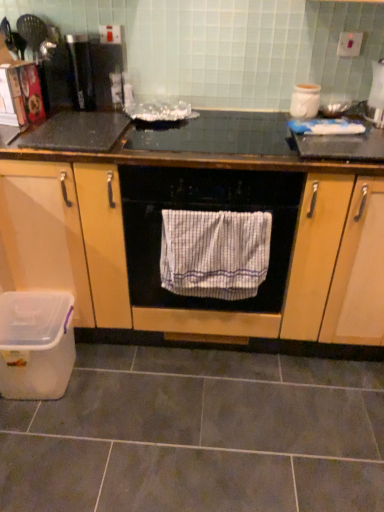
Question: Is white striped towel at center in front of white glossy kettle at upper right, which appears as the first appliance when viewed from the right?

Choices:
 (A) yes
 (B) no

Answer: (A)

Question: Is white striped towel at center looking in the opposite direction of white glossy kettle at upper right, which appears as the 2th appliance when viewed from the left?

Choices:
 (A) yes
 (B) no

Answer: (B)

Question: From the image's perspective, is white striped towel at center below white glossy kettle at upper right, which appears as the 2th appliance when viewed from the left?

Choices:
 (A) no
 (B) yes

Answer: (B)

Question: Does white striped towel at center have a lesser width compared to white glossy kettle at upper right, which appears as the first appliance when viewed from the right?

Choices:
 (A) yes
 (B) no

Answer: (A)

Question: Is white striped towel at center at the left side of white glossy kettle at upper right, which appears as the 2th appliance when viewed from the left?

Choices:
 (A) no
 (B) yes

Answer: (B)

Question: Is white striped towel at center positioned behind white glossy kettle at upper right, which appears as the 2th appliance when viewed from the left?

Choices:
 (A) yes
 (B) no

Answer: (B)

Question: Is gray matte tile at lower center wider than wooden cabinet at center?

Choices:
 (A) no
 (B) yes

Answer: (B)

Question: From the image's perspective, is gray matte tile at lower center located beneath wooden cabinet at center?

Choices:
 (A) yes
 (B) no

Answer: (A)

Question: Does gray matte tile at lower center come in front of wooden cabinet at center?

Choices:
 (A) yes
 (B) no

Answer: (A)

Question: Does gray matte tile at lower center appear on the left side of wooden cabinet at center?

Choices:
 (A) no
 (B) yes

Answer: (B)

Question: From a real-world perspective, does gray matte tile at lower center sit lower than wooden cabinet at center?

Choices:
 (A) yes
 (B) no

Answer: (A)

Question: Is gray matte tile at lower center taller than wooden cabinet at center?

Choices:
 (A) no
 (B) yes

Answer: (A)

Question: Is gray matte tile at lower center positioned behind white striped towel at center?

Choices:
 (A) yes
 (B) no

Answer: (B)